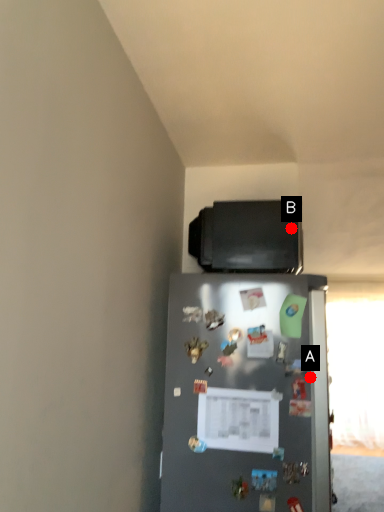
Question: Two points are circled on the image, labeled by A and B beside each circle. Which point is closer to the camera?

Choices:
 (A) A is closer
 (B) B is closer

Answer: (A)